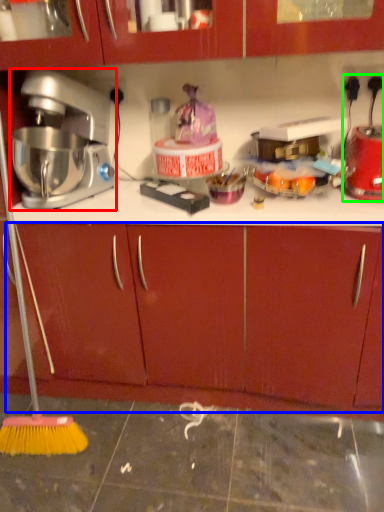
Question: Which object is positioned farthest from mixer (highlighted by a red box)? Select from drawer (highlighted by a blue box) and blender (highlighted by a green box).

Choices:
 (A) drawer
 (B) blender

Answer: (B)